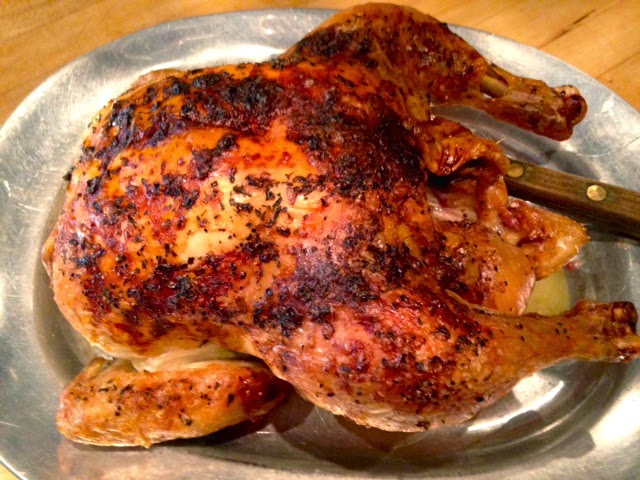
Where is `place to hold utensil`? place to hold utensil is located at coordinates (585, 193).